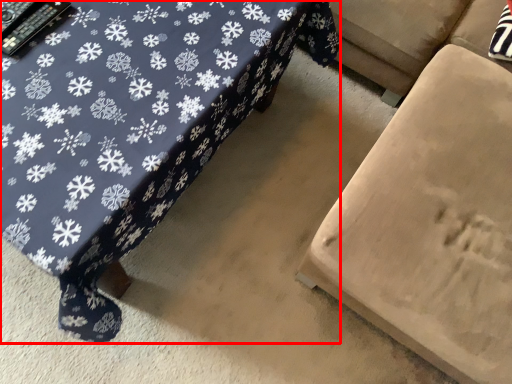
Question: Where is table (annotated by the red box) located in relation to furniture in the image?

Choices:
 (A) right
 (B) left

Answer: (B)